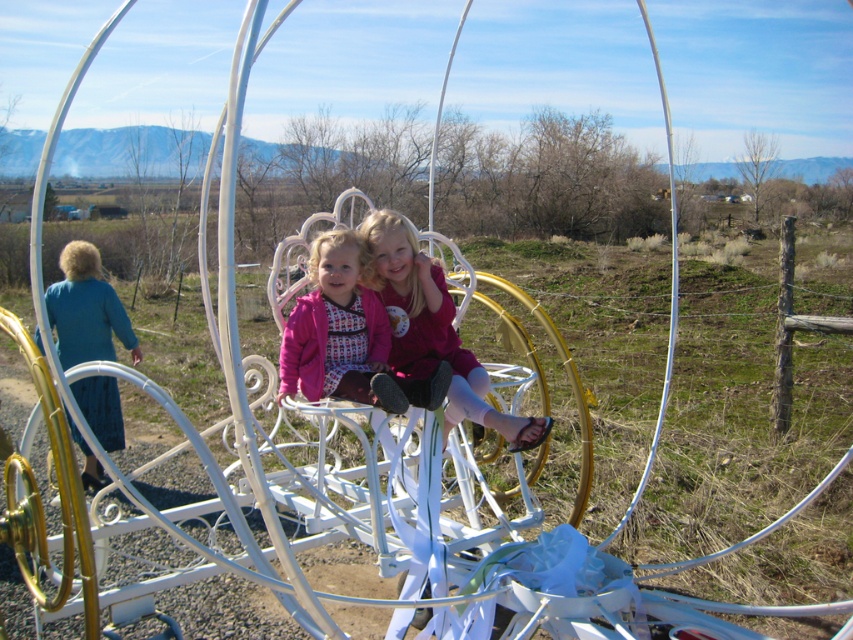
Can you confirm if matte pink dress at center is positioned to the left of matte pink jacket at center?

No, matte pink dress at center is not to the left of matte pink jacket at center.

Does matte pink dress at center have a smaller size compared to matte pink jacket at center?

No, matte pink dress at center is not smaller than matte pink jacket at center.

Where is `matte pink dress at center`? Image resolution: width=853 pixels, height=640 pixels. matte pink dress at center is located at coordinates (432, 330).